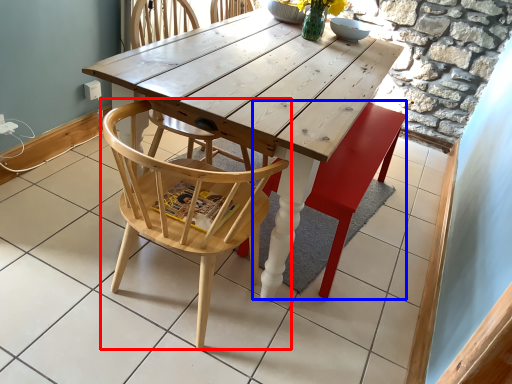
Question: Which object is further to the camera taking this photo, chair (highlighted by a red box) or swivel chair (highlighted by a blue box)?

Choices:
 (A) chair
 (B) swivel chair

Answer: (B)